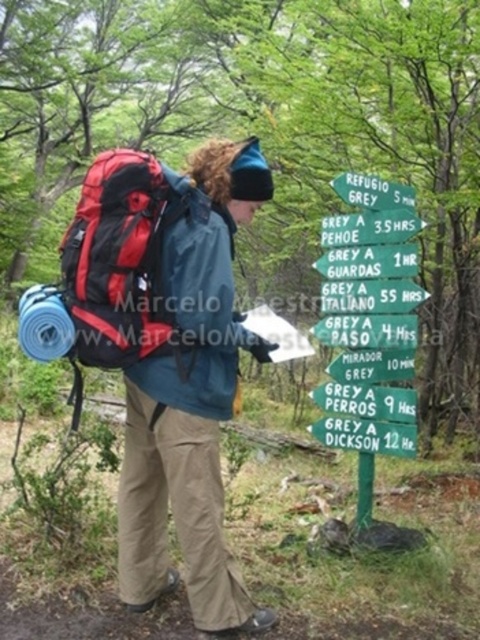
Is green wooden signpost at upper center wider than red fabric backpack at left?

No.

Is green wooden signpost at upper center to the left of red fabric backpack at left from the viewer's perspective?

No, green wooden signpost at upper center is not to the left of red fabric backpack at left.

Between point (336, 326) and point (140, 307), which one is positioned in front?

Point (140, 307)

Where is `green wooden signpost at upper center`? green wooden signpost at upper center is located at coordinates (369, 317).